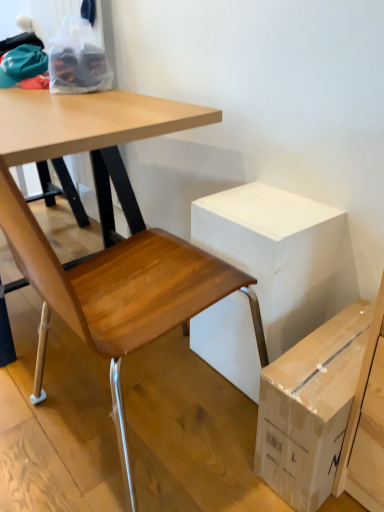
Describe the element at coordinates (281, 255) in the screenshot. I see `white cardboard box at center` at that location.

Locate an element on the screen. wooden chair at lower left is located at coordinates (119, 295).

Can you tell me how much brown cardboard box at lower right and white cardboard box at center differ in facing direction?

brown cardboard box at lower right and white cardboard box at center are facing 0.00181 degrees away from each other.

Is brown cardboard box at lower right facing towards white cardboard box at center?

No, brown cardboard box at lower right is not turned towards white cardboard box at center.

Looking at their sizes, would you say brown cardboard box at lower right is wider or thinner than white cardboard box at center?

Considering their sizes, brown cardboard box at lower right looks broader than white cardboard box at center.

Is brown cardboard box at lower right outside of white cardboard box at center?

That's correct, brown cardboard box at lower right is outside of white cardboard box at center.

Considering the positions of objects white cardboard box at center and brown cardboard box at lower right in the image provided, who is more to the right, white cardboard box at center or brown cardboard box at lower right?

brown cardboard box at lower right.

In the scene shown: From a real-world perspective, is white cardboard box at center located beneath brown cardboard box at lower right?

No.

Between white cardboard box at center and brown cardboard box at lower right, which one has larger width?

With larger width is brown cardboard box at lower right.

What's the angular difference between white cardboard box at center and brown cardboard box at lower right's facing directions?

0.00181 degrees.

From the image's perspective, is brown cardboard box at lower right beneath wooden chair at lower left?

Yes.

In the scene shown: Which object is wider, brown cardboard box at lower right or wooden chair at lower left?

With larger width is wooden chair at lower left.

Is wooden chair at lower left a part of brown cardboard box at lower right?

Definitely not — wooden chair at lower left is not inside brown cardboard box at lower right.

Which object is more forward, white cardboard box at center or wooden chair at lower left?

wooden chair at lower left is more forward.

Locate an element on the screen. cardboard box below the wooden chair at lower left (from the image's perspective) is located at coordinates (281, 255).

Is white cardboard box at center aimed at wooden chair at lower left?

Yes, white cardboard box at center is turned towards wooden chair at lower left.

From a real-world perspective, who is located higher, white cardboard box at center or wooden chair at lower left?

wooden chair at lower left.

Considering the positions of objects wooden chair at lower left and white cardboard box at center in the image provided, who is more to the right, wooden chair at lower left or white cardboard box at center?

white cardboard box at center is more to the right.

Who is shorter, wooden chair at lower left or white cardboard box at center?

With less height is white cardboard box at center.

Does wooden chair at lower left turn towards white cardboard box at center?

Yes, wooden chair at lower left is aimed at white cardboard box at center.

Considering the relative sizes of wooden chair at lower left and brown cardboard box at lower right in the image provided, is wooden chair at lower left taller than brown cardboard box at lower right?

Yes, wooden chair at lower left is taller than brown cardboard box at lower right.

Is wooden chair at lower left to the right of brown cardboard box at lower right from the viewer's perspective?

No.

From the picture: Is wooden chair at lower left closer to camera compared to brown cardboard box at lower right?

Yes, it is in front of brown cardboard box at lower right.

Would you say wooden chair at lower left is a long distance from brown cardboard box at lower right?

No, wooden chair at lower left is not far from brown cardboard box at lower right.

Where is `cardboard box behind the brown cardboard box at lower right`? This screenshot has width=384, height=512. cardboard box behind the brown cardboard box at lower right is located at coordinates (281, 255).

You are a GUI agent. You are given a task and a screenshot of the screen. Output one action in this format:
    pyautogui.click(x=<x>, y=<y>)
    Task: Click on the box on the right of white cardboard box at center
    
    Given the screenshot: What is the action you would take?
    pyautogui.click(x=310, y=408)

Estimate the real-world distances between objects in this image. Which object is closer to white cardboard box at center, brown cardboard box at lower right or wooden chair at lower left?

wooden chair at lower left.

Estimate the real-world distances between objects in this image. Which object is closer to wooden chair at lower left, white cardboard box at center or brown cardboard box at lower right?

white cardboard box at center is positioned closer to the anchor wooden chair at lower left.

When comparing their distances from wooden chair at lower left, does brown cardboard box at lower right or white cardboard box at center seem closer?

Among the two, white cardboard box at center is located nearer to wooden chair at lower left.

Looking at the image, which one is located further to brown cardboard box at lower right, white cardboard box at center or wooden chair at lower left?

wooden chair at lower left lies further to brown cardboard box at lower right than the other object.

From the image, which object appears to be nearer to brown cardboard box at lower right, wooden chair at lower left or white cardboard box at center?

The object closer to brown cardboard box at lower right is white cardboard box at center.

Estimate the real-world distances between objects in this image. Which object is further from white cardboard box at center, wooden chair at lower left or brown cardboard box at lower right?

brown cardboard box at lower right lies further to white cardboard box at center than the other object.

You are a GUI agent. You are given a task and a screenshot of the screen. Output one action in this format:
    pyautogui.click(x=<x>, y=<y>)
    Task: Click on the box positioned between wooden chair at lower left and white cardboard box at center from near to far
    
    Given the screenshot: What is the action you would take?
    pyautogui.click(x=310, y=408)